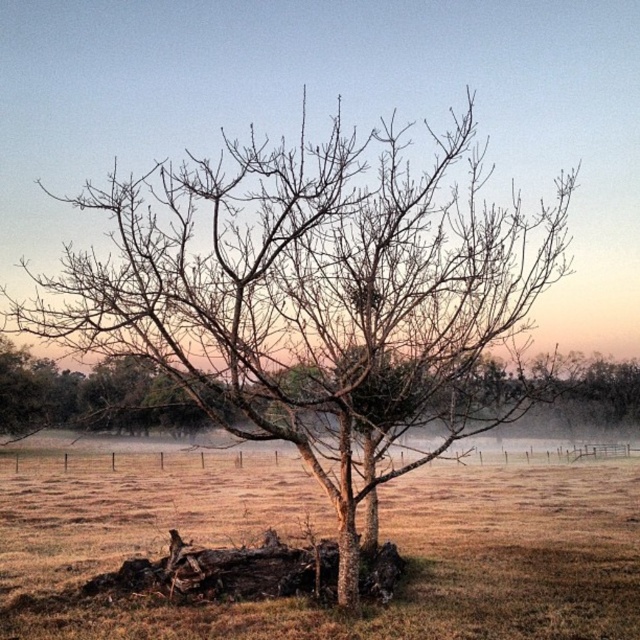
Which is more to the right, brown grass at center or bare wood tree at center?

From the viewer's perspective, bare wood tree at center appears more on the right side.

Is brown grass at center to the left of bare wood tree at center from the viewer's perspective?

Yes, brown grass at center is to the left of bare wood tree at center.

What are the coordinates of `brown grass at center` in the screenshot? It's located at (445, 566).